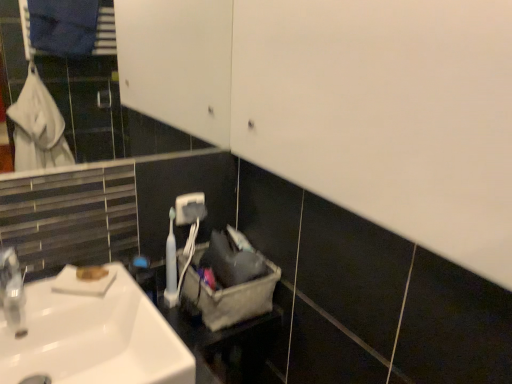
Question: Looking at their shapes, would you say white plastic toothbrush at center is wider or thinner than white matte soap at lower left?

Choices:
 (A) wide
 (B) thin

Answer: (B)

Question: From the image's perspective, is white plastic toothbrush at center located above or below white matte soap at lower left?

Choices:
 (A) above
 (B) below

Answer: (A)

Question: Which is nearer to the white plastic toothbrush at center?

Choices:
 (A) gray fabric laundry basket at center
 (B) white matte soap at lower left
 (C) white glossy sink at lower left

Answer: (A)

Question: Based on their relative distances, which object is farther from the white matte soap at lower left?

Choices:
 (A) white glossy sink at lower left
 (B) gray fabric laundry basket at center
 (C) white plastic toothbrush at center

Answer: (B)